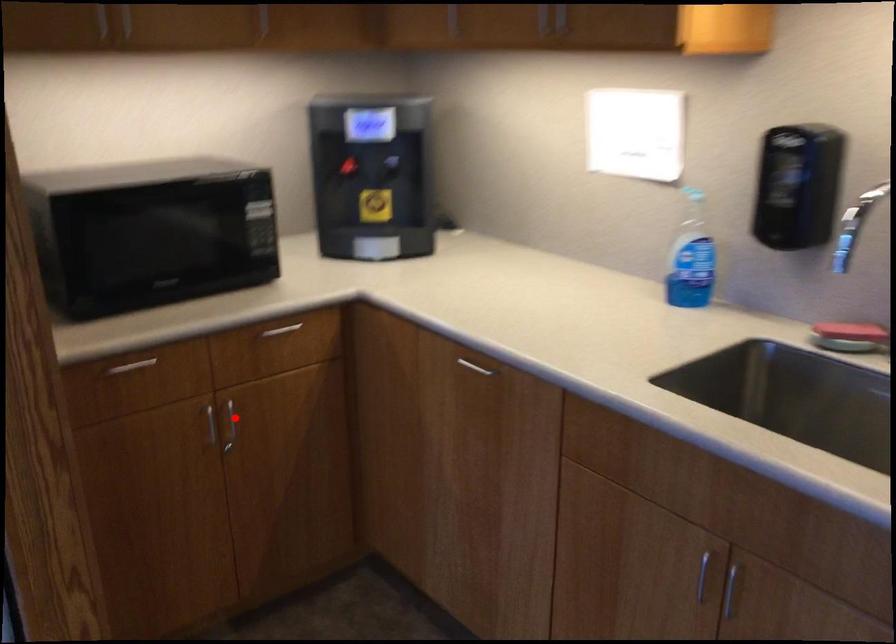
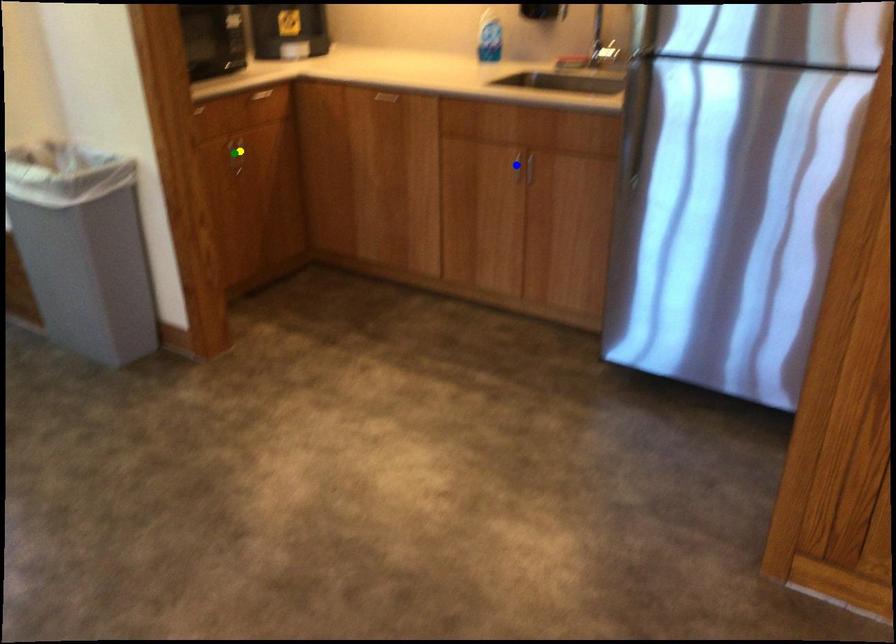
Question: I am providing you with two images of the same scene from different viewpoints. A red point is marked on the first image. You are given multiple points on the second image. Which mark in image 2 goes with the point in image 1?

Choices:
 (A) yellow point
 (B) green point
 (C) blue point

Answer: (A)